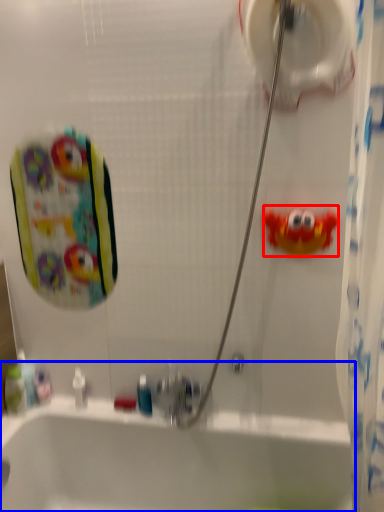
Question: Among these objects, which one is farthest to the camera, toy (highlighted by a red box) or bathtub (highlighted by a blue box)?

Choices:
 (A) toy
 (B) bathtub

Answer: (A)